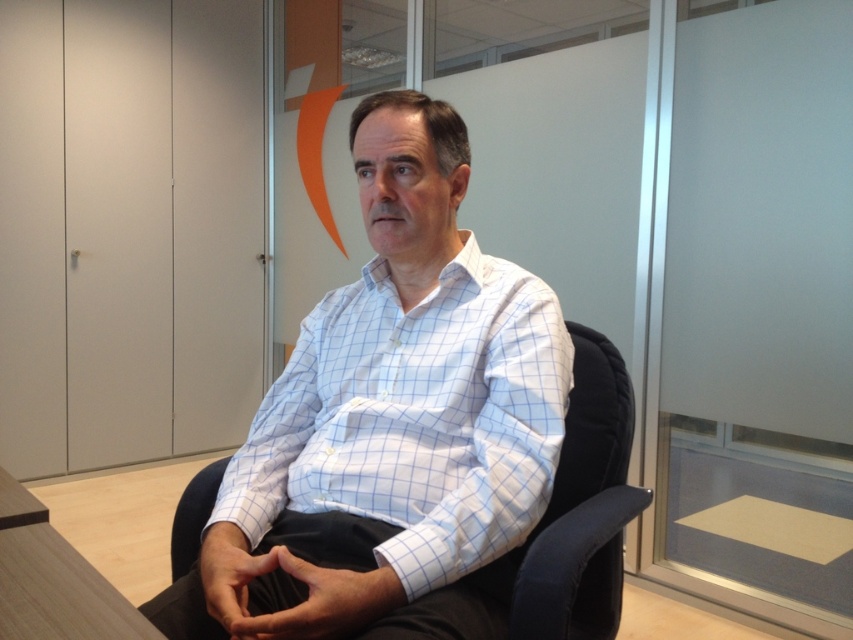
Question: Which of the following is the closest to the observer?

Choices:
 (A) (440, 422)
 (B) (606, 356)

Answer: (A)

Question: Is white checkered shirt at center above black fabric swivel chair at center?

Choices:
 (A) yes
 (B) no

Answer: (A)

Question: In this image, where is white checkered shirt at center located relative to black fabric swivel chair at center?

Choices:
 (A) left
 (B) right

Answer: (A)

Question: Which point appears closest to the camera in this image?

Choices:
 (A) (415, 556)
 (B) (538, 554)

Answer: (A)

Question: Is white checkered shirt at center positioned in front of black fabric swivel chair at center?

Choices:
 (A) no
 (B) yes

Answer: (B)

Question: Which point is closer to the camera?

Choices:
 (A) white checkered shirt at center
 (B) black fabric swivel chair at center

Answer: (A)